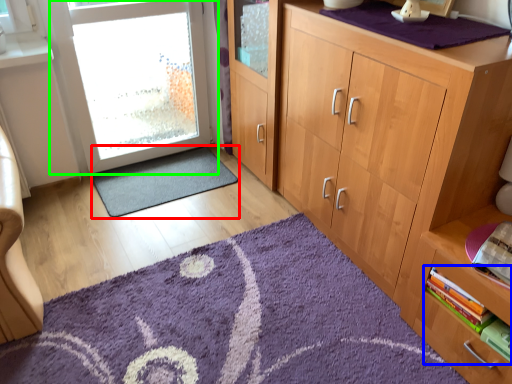
Question: Which object is the farthest from doormat (highlighted by a red box)? Choose among these: book (highlighted by a blue box) or door (highlighted by a green box).

Choices:
 (A) book
 (B) door

Answer: (A)